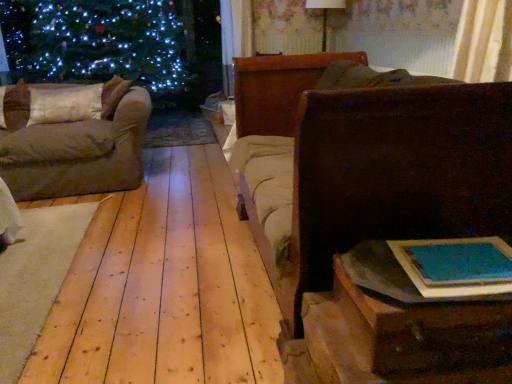
Identify the location of empty space that is ontop of wooden table at lower right (from a real-world perspective). This screenshot has height=384, width=512. (455, 260).